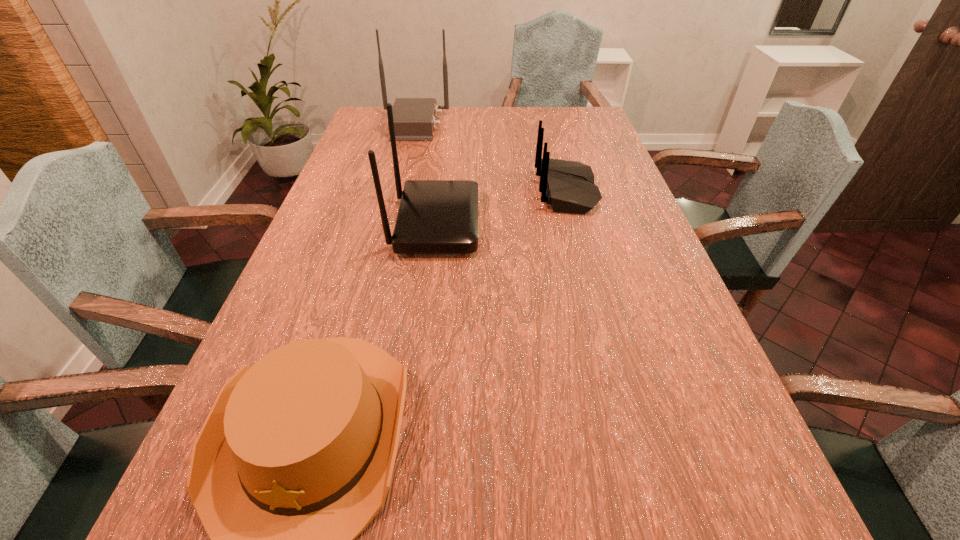
Where is `object that is at the far left corner`? object that is at the far left corner is located at coordinates (414, 119).

The image size is (960, 540). Identify the location of free spot at the left edge of the desktop. (330, 241).

In order to click on free space at the right edge of the desktop in this screenshot , I will do `click(624, 204)`.

The image size is (960, 540). I want to click on vacant point at the far right corner, so click(x=570, y=129).

You are a GUI agent. You are given a task and a screenshot of the screen. Output one action in this format:
    pyautogui.click(x=<x>, y=<y>)
    Task: Click on the free space between the rightmost object and the farthest router
    This screenshot has width=960, height=540.
    Given the screenshot: What is the action you would take?
    pyautogui.click(x=491, y=158)

Identify which object is located as the third nearest to the nearest object. Please provide its 2D coordinates. Your answer should be formatted as a tuple, i.e. [(x, y)], where the tuple contains the x and y coordinates of a point satisfying the conditions above.

[(414, 119)]

Point out which object is positioned as the second nearest to the shortest object. Please provide its 2D coordinates. Your answer should be formatted as a tuple, i.e. [(x, y)], where the tuple contains the x and y coordinates of a point satisfying the conditions above.

[(568, 186)]

Choose which router is the second nearest neighbor to the rightmost object. Please provide its 2D coordinates. Your answer should be formatted as a tuple, i.e. [(x, y)], where the tuple contains the x and y coordinates of a point satisfying the conditions above.

[(414, 119)]

The image size is (960, 540). I want to click on the second closest router to the farthest router, so click(435, 216).